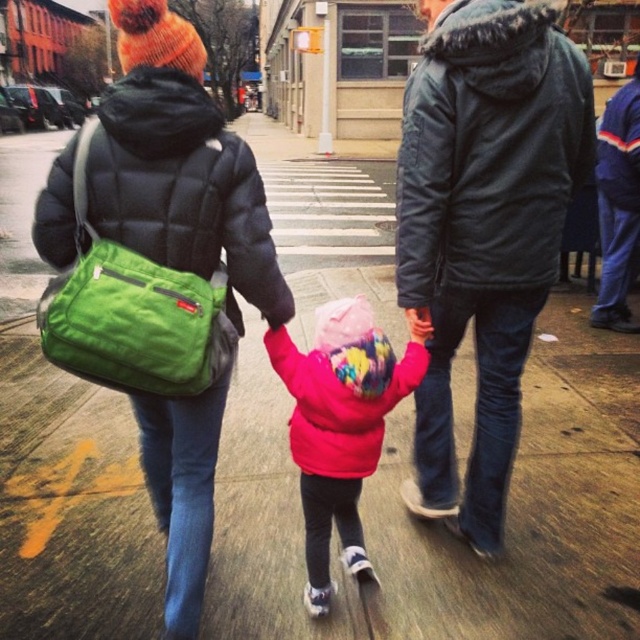
You are standing on the sidewalk and see three people walking away from you. The adult on the left has a green messenger bag slung over their shoulder, and the adult on the right has a fur lined hood on their dark gray puffer jacket. The child between them is wearing a pink puffer jacket. There is a point marked at coordinates (160, 273). Which object does this point correspond to?

The point at coordinates (160, 273) corresponds to the green fabric bag at upper left.

You are a photographer standing on the sidewalk. You want to take a photo of the matte pink coat at center and the blue fleece jacket at right. Since you want both subjects to be in focus, which one should you focus on first to ensure the other is also sharp?

You should focus on the matte pink coat at center first because it is in front of the blue fleece jacket at right, so focusing on the closer subject will help keep both in focus.

You are standing on the sidewalk and see the matte black jacket at upper left and the matte pink coat at center. Which one is positioned more to the left side?

The matte black jacket at upper left is positioned more to the left side than the matte pink coat at center.